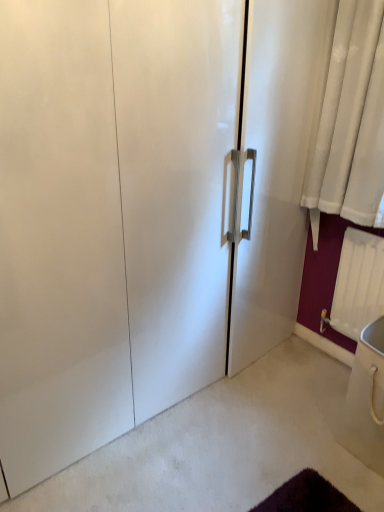
Question: Would you say white plastic radiator at lower right is to the left or to the right of white glossy sink at lower right in the picture?

Choices:
 (A) right
 (B) left

Answer: (B)

Question: Considering the positions of white plastic radiator at lower right and white glossy sink at lower right in the image, is white plastic radiator at lower right wider or thinner than white glossy sink at lower right?

Choices:
 (A) wide
 (B) thin

Answer: (B)

Question: From the image's perspective, is white plastic radiator at lower right positioned above or below white glossy sink at lower right?

Choices:
 (A) below
 (B) above

Answer: (B)

Question: In the image, is white glossy sink at lower right on the left side or the right side of white plastic radiator at lower right?

Choices:
 (A) left
 (B) right

Answer: (B)

Question: In terms of height, does white glossy sink at lower right look taller or shorter compared to white plastic radiator at lower right?

Choices:
 (A) tall
 (B) short

Answer: (B)

Question: From the image's perspective, relative to white plastic radiator at lower right, is white glossy sink at lower right above or below?

Choices:
 (A) above
 (B) below

Answer: (B)

Question: From a real-world perspective, is white glossy sink at lower right physically located above or below white plastic radiator at lower right?

Choices:
 (A) above
 (B) below

Answer: (B)